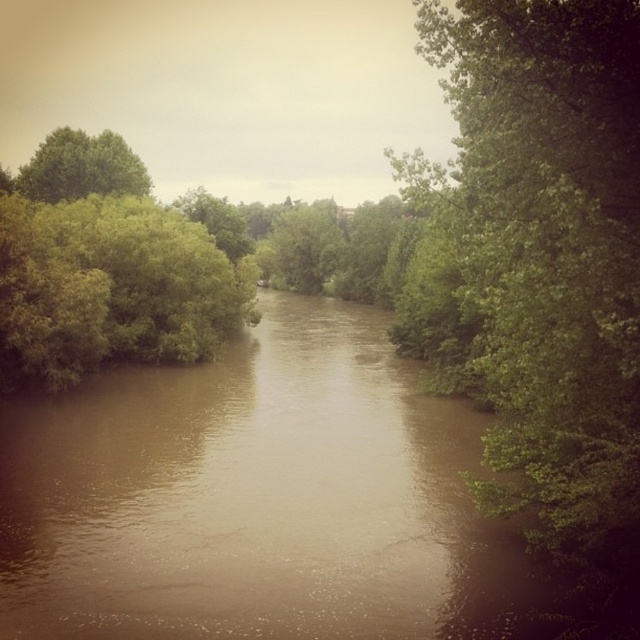
Describe the element at coordinates (548, 248) in the screenshot. I see `green leafy tree at right` at that location.

Find the location of `green leafy tree at right`. green leafy tree at right is located at coordinates (548, 248).

Between point (58, 138) and point (264, 241), which one is positioned in front?

Point (58, 138) is more forward.

Is point (141, 195) farther from viewer compared to point (259, 244)?

No, it is in front of (259, 244).

Find the location of `green leafy tree at upper left`. green leafy tree at upper left is located at coordinates (81, 168).

Is green leafy tree at right below green leafy tree at upper left?

Yes.

Does green leafy tree at right have a greater height compared to green leafy tree at upper left?

Incorrect, green leafy tree at right's height is not larger of green leafy tree at upper left's.

Is point (636, 68) more distant than point (108, 163)?

That is False.

At what (x,y) coordinates should I click in order to perform the action: click on green leafy tree at right. Please return your answer as a coordinate pair (x, y). Looking at the image, I should click on (548, 248).